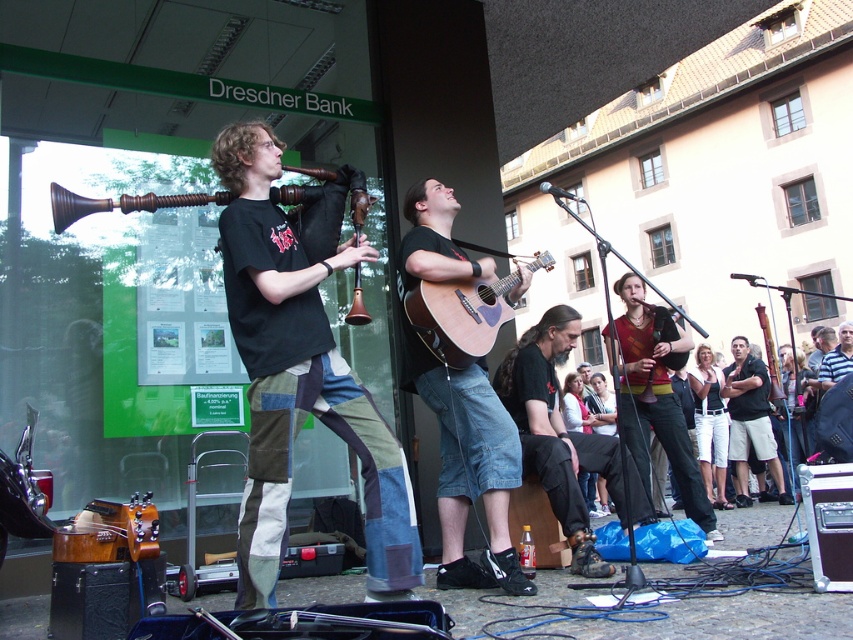
Question: Is dark brown leather shoes at lower center wider than acoustic wood guitar at center?

Choices:
 (A) yes
 (B) no

Answer: (B)

Question: Which point is farther to the camera?

Choices:
 (A) wooden horn at center
 (B) white cotton shorts at lower right
 (C) matte brown vest at center

Answer: (B)

Question: Which point appears farthest from the camera in this image?

Choices:
 (A) (602, 401)
 (B) (735, 484)

Answer: (A)

Question: Estimate the real-world distances between objects in this image. Which object is closer to the dark brown leather shoes at lower center?

Choices:
 (A) matte brown vest at center
 (B) light blue jeans at lower center
 (C) white cotton shorts at lower right

Answer: (A)

Question: Does black cotton shirt at center lie behind white cotton shorts at lower right?

Choices:
 (A) yes
 (B) no

Answer: (A)

Question: Can you confirm if wooden acoustic guitar at center is thinner than white cotton shorts at lower right?

Choices:
 (A) no
 (B) yes

Answer: (A)